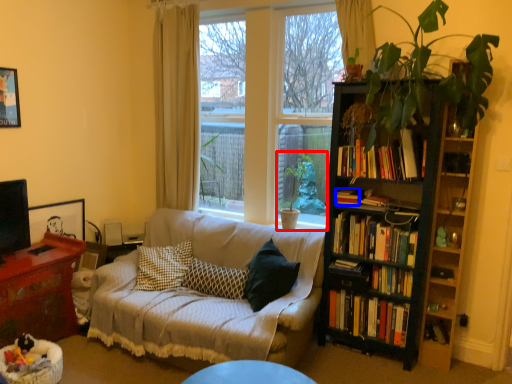
Question: Which object appears closest to the camera in this image, houseplant (highlighted by a red box) or book (highlighted by a blue box)?

Choices:
 (A) houseplant
 (B) book

Answer: (B)